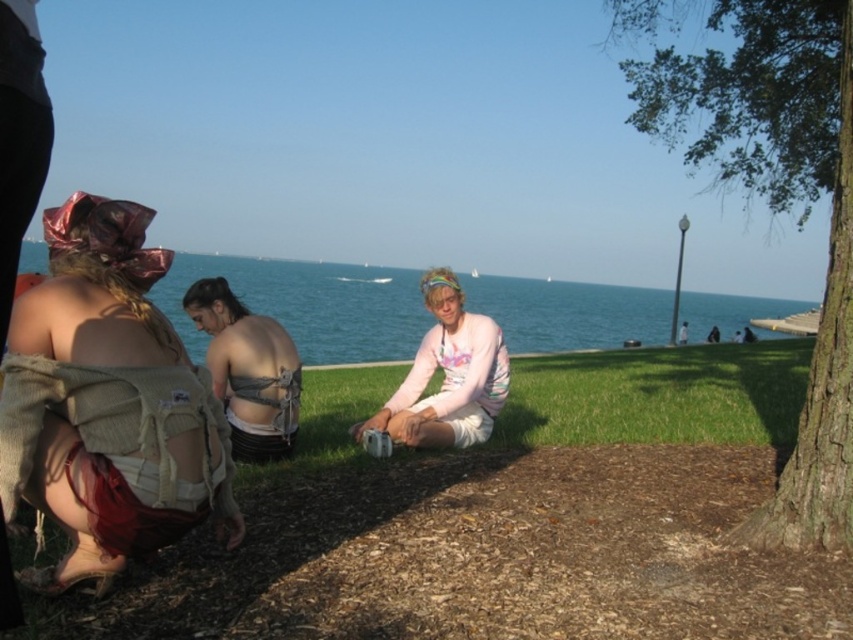
Question: Does brown rough bark tree at center right come in front of pink cotton shirt at center?

Choices:
 (A) yes
 (B) no

Answer: (A)

Question: Is green grass at center bigger than pink cotton shirt at center?

Choices:
 (A) yes
 (B) no

Answer: (A)

Question: Which object is the farthest from the pink cotton shirt at center?

Choices:
 (A) blue water at center
 (B) matte beige backpack at lower left

Answer: (A)

Question: Estimate the real-world distances between objects in this image. Which object is farther from the pink cotton shirt at center?

Choices:
 (A) brown rough bark tree at center right
 (B) green grass at center
 (C) blue water at center
 (D) matte gray fabric at center

Answer: (C)

Question: Which of the following is the closest to the observer?

Choices:
 (A) (556, 435)
 (B) (619, 291)
 (C) (778, 77)

Answer: (A)

Question: Does blue water at center appear over pink cotton shirt at center?

Choices:
 (A) yes
 (B) no

Answer: (A)